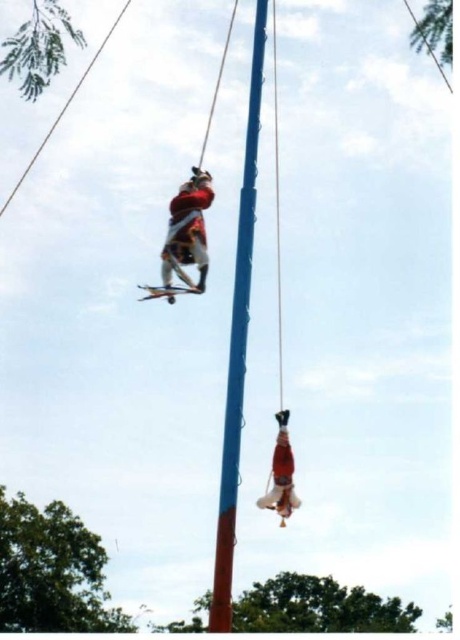
Based on the scene description, what is located at the coordinates point (188, 230)?

The red fabric person at upper center is located at point (188, 230).

You are standing at a safe distance from the blue painted wood pole at center where the Voladores de Papantla ritual is taking place. According to safety guidelines, spectators must stay at least 60 feet away from the pole to avoid injury. Are you within the safe zone?

The blue painted wood pole at center is 58.82 feet away from the viewer. Since the required safe distance is 60 feet, you are currently 1.18 feet too close and need to move back to ensure safety.